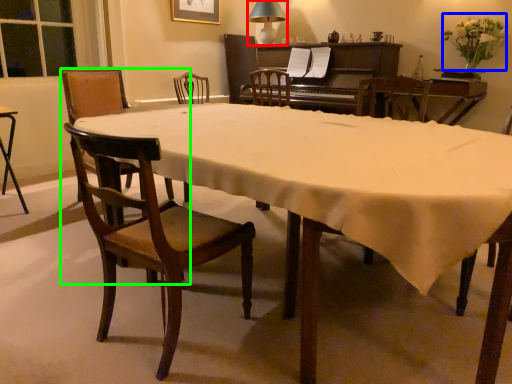
Question: Considering the real-world distances, which object is farthest from lamp (highlighted by a red box)? flower (highlighted by a blue box) or chair (highlighted by a green box)?

Choices:
 (A) flower
 (B) chair

Answer: (B)